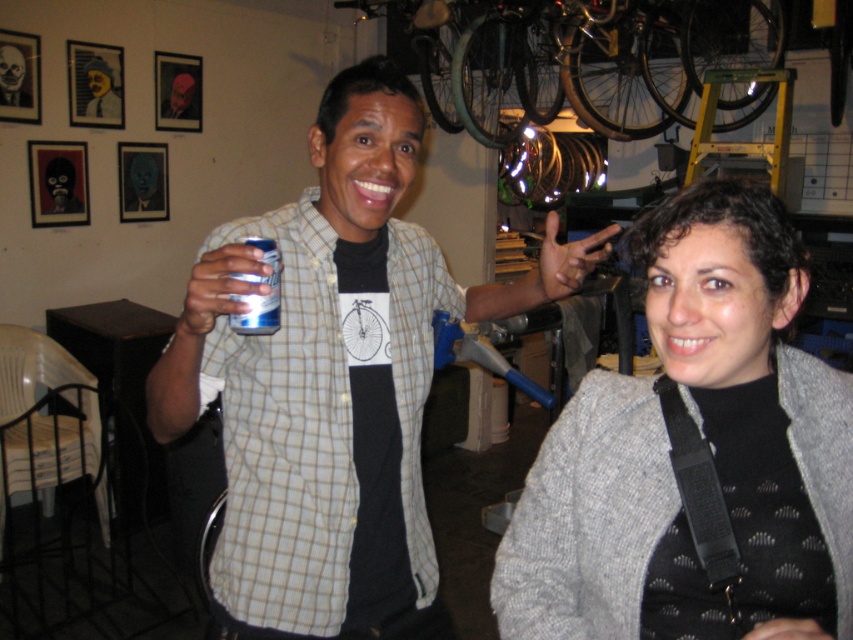
Question: Is matte black can at center above silver metallic can at center?

Choices:
 (A) yes
 (B) no

Answer: (B)

Question: Which object appears closest to the camera in this image?

Choices:
 (A) matte black can at center
 (B) silver metallic can at center
 (C) gray wool sweater at center
 (D) matte black hand at upper center

Answer: (C)

Question: Where is gray wool sweater at center located in relation to metallic blue can at center in the image?

Choices:
 (A) above
 (B) below

Answer: (B)

Question: Which object is positioned closest to the matte black hand at upper center?

Choices:
 (A) gray wool sweater at center
 (B) matte black can at center

Answer: (A)

Question: Can you confirm if metallic blue can at center is thinner than silver metallic can at center?

Choices:
 (A) no
 (B) yes

Answer: (A)

Question: Which point appears closest to the camera in this image?

Choices:
 (A) (250, 243)
 (B) (421, 348)

Answer: (A)